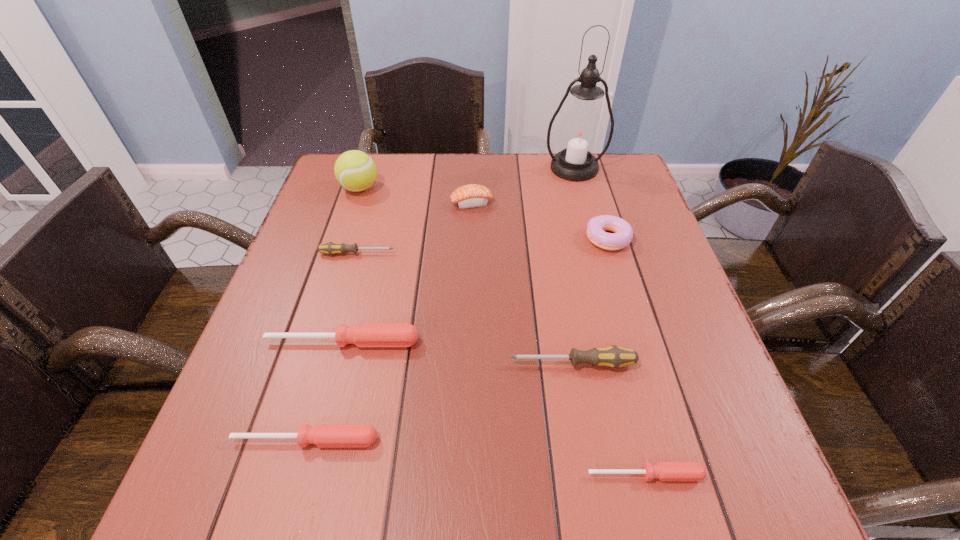
Where is `the second farthest red screwdriver`? The width and height of the screenshot is (960, 540). the second farthest red screwdriver is located at coordinates (325, 435).

Locate an element on the screen. Image resolution: width=960 pixels, height=540 pixels. the second nearest screwdriver is located at coordinates (325, 435).

Where is `the left gray screwdriver`? This screenshot has height=540, width=960. the left gray screwdriver is located at coordinates (331, 248).

You are a GUI agent. You are given a task and a screenshot of the screen. Output one action in this format:
    pyautogui.click(x=<x>, y=<y>)
    Task: Click on the farthest screwdriver
    Image resolution: width=960 pixels, height=540 pixels.
    Given the screenshot: What is the action you would take?
    [x=331, y=248]

Image resolution: width=960 pixels, height=540 pixels. Find the location of `the nearest red screwdriver`. the nearest red screwdriver is located at coordinates click(x=665, y=471).

What are the coordinates of `the rightmost red screwdriver` in the screenshot? It's located at (665, 471).

Identify the location of free space located on the left of the tallest object. Image resolution: width=960 pixels, height=540 pixels. (472, 168).

Where is `free space located 0.190m on the front of the green tennis ball`? free space located 0.190m on the front of the green tennis ball is located at coordinates coord(340,247).

Locate an element on the screen. vacant position located on the back of the sushi is located at coordinates (472, 177).

Locate an element on the screen. This screenshot has height=540, width=960. free space located 0.170m on the front of the purple doughnut is located at coordinates [x=630, y=309].